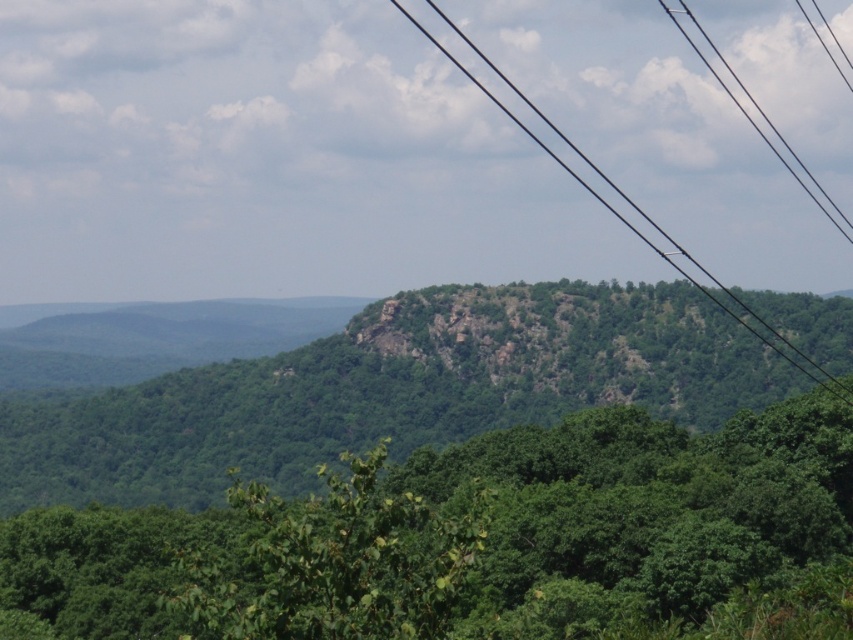
From the picture: Does black wire at upper center appear on the left side of black wire at upper right?

Yes, black wire at upper center is to the left of black wire at upper right.

Which is more to the left, black wire at upper center or black wire at upper right?

black wire at upper center

Which is in front, point (630, 202) or point (746, 90)?

Point (630, 202) is in front.

Find the location of a particular element. This screenshot has width=853, height=640. black wire at upper center is located at coordinates (627, 202).

Can you confirm if green rocky mountain at center is taller than black wire at upper center?

No.

Based on the photo, who is more forward, (669, 321) or (779, 337)?

Point (669, 321)

Find the location of `green rocky mountain at center`. green rocky mountain at center is located at coordinates (390, 390).

Which is in front, point (682, 556) or point (706, 36)?

Positioned in front is point (682, 556).

Is green leafy tree at center smaller than black wire at upper right?

Yes, green leafy tree at center is smaller than black wire at upper right.

Who is more forward, (840, 544) or (706, 35)?

Point (840, 544)

Locate an element on the screen. Image resolution: width=853 pixels, height=640 pixels. green leafy tree at center is located at coordinates (637, 513).